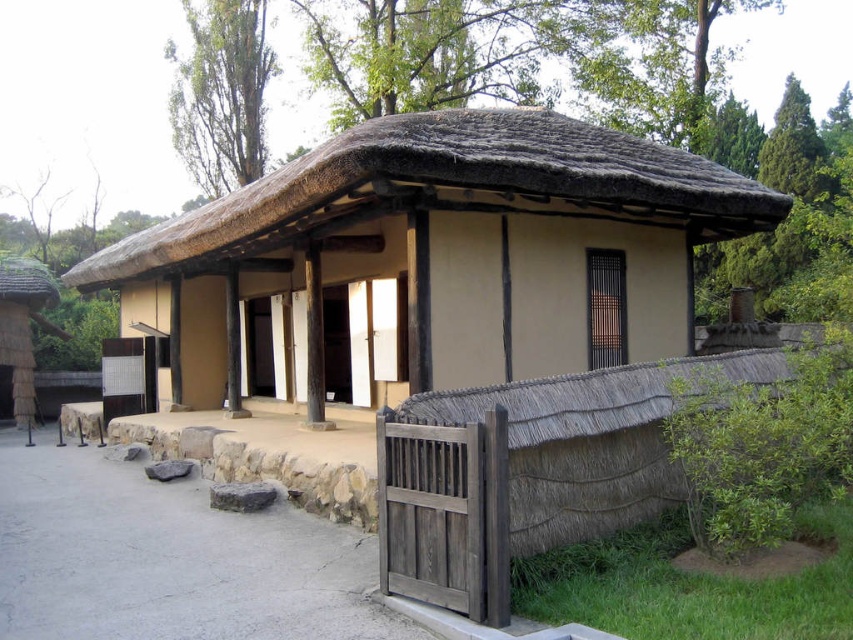
Question: Is beige thatched roof hut at center wider than thatched straw roof at center?

Choices:
 (A) no
 (B) yes

Answer: (A)

Question: In this image, where is beige thatched roof hut at center located relative to thatched straw roof at center?

Choices:
 (A) right
 (B) left

Answer: (A)

Question: Does beige thatched roof hut at center come in front of thatched straw roof at center?

Choices:
 (A) yes
 (B) no

Answer: (A)

Question: Which point is closer to the camera taking this photo?

Choices:
 (A) (534, 316)
 (B) (103, 275)

Answer: (A)

Question: Among these objects, which one is nearest to the camera?

Choices:
 (A) thatched straw roof at center
 (B) beige thatched roof hut at center

Answer: (B)